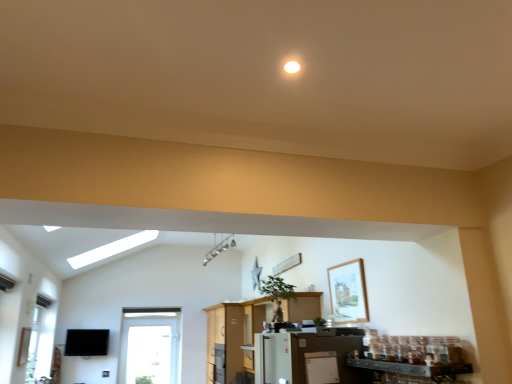
Question: Is white matte refrigerator at lower center positioned far away from transparent glass window at lower left?

Choices:
 (A) no
 (B) yes

Answer: (B)

Question: From a real-world perspective, is white matte refrigerator at lower center over transparent glass window at lower left?

Choices:
 (A) no
 (B) yes

Answer: (A)

Question: Does white matte refrigerator at lower center have a greater height compared to transparent glass window at lower left?

Choices:
 (A) yes
 (B) no

Answer: (B)

Question: Considering the relative positions of white matte refrigerator at lower center and transparent glass window at lower left in the image provided, is white matte refrigerator at lower center to the left of transparent glass window at lower left from the viewer's perspective?

Choices:
 (A) no
 (B) yes

Answer: (A)

Question: Is white matte refrigerator at lower center oriented towards transparent glass window at lower left?

Choices:
 (A) yes
 (B) no

Answer: (B)

Question: Based on their positions, is transparent glass window at lower left located to the left or right of white matte refrigerator at lower center?

Choices:
 (A) right
 (B) left

Answer: (B)

Question: In terms of size, does transparent glass window at lower left appear bigger or smaller than white matte refrigerator at lower center?

Choices:
 (A) small
 (B) big

Answer: (B)

Question: In the image, is transparent glass window at lower left positioned in front of or behind white matte refrigerator at lower center?

Choices:
 (A) front
 (B) behind

Answer: (B)

Question: Looking at their shapes, would you say transparent glass window at lower left is wider or thinner than white matte refrigerator at lower center?

Choices:
 (A) wide
 (B) thin

Answer: (A)

Question: In terms of size, does white glossy refrigerator at center appear bigger or smaller than wooden framed picture at upper right?

Choices:
 (A) small
 (B) big

Answer: (B)

Question: Considering their positions, is white glossy refrigerator at center located in front of or behind wooden framed picture at upper right?

Choices:
 (A) front
 (B) behind

Answer: (B)

Question: Does point (x=268, y=296) appear closer or farther from the camera than point (x=352, y=291)?

Choices:
 (A) farther
 (B) closer

Answer: (A)

Question: From the image's perspective, relative to wooden framed picture at upper right, is white glossy refrigerator at center above or below?

Choices:
 (A) above
 (B) below

Answer: (B)

Question: Is point (306, 367) positioned closer to the camera than point (240, 322)?

Choices:
 (A) farther
 (B) closer

Answer: (B)

Question: Looking at the image, does white matte refrigerator at lower center seem bigger or smaller compared to white glossy refrigerator at center?

Choices:
 (A) small
 (B) big

Answer: (A)